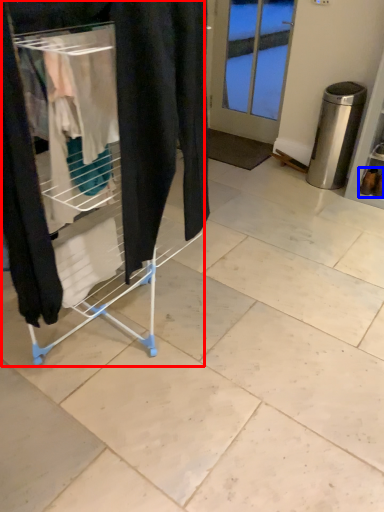
Question: Which of the following is the closest to the observer, furniture (highlighted by a red box) or footwear (highlighted by a blue box)?

Choices:
 (A) furniture
 (B) footwear

Answer: (A)